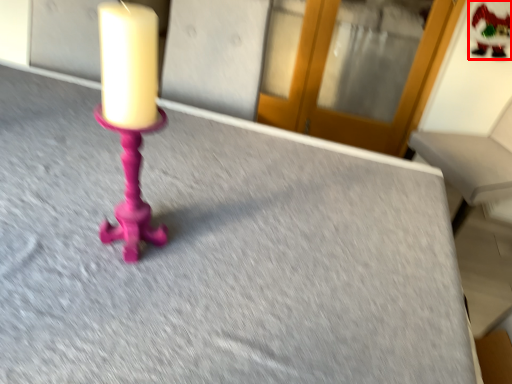
Question: From the image, what is the correct spatial relationship of santa claus (annotated by the red box) in relation to glass door?

Choices:
 (A) left
 (B) right

Answer: (B)